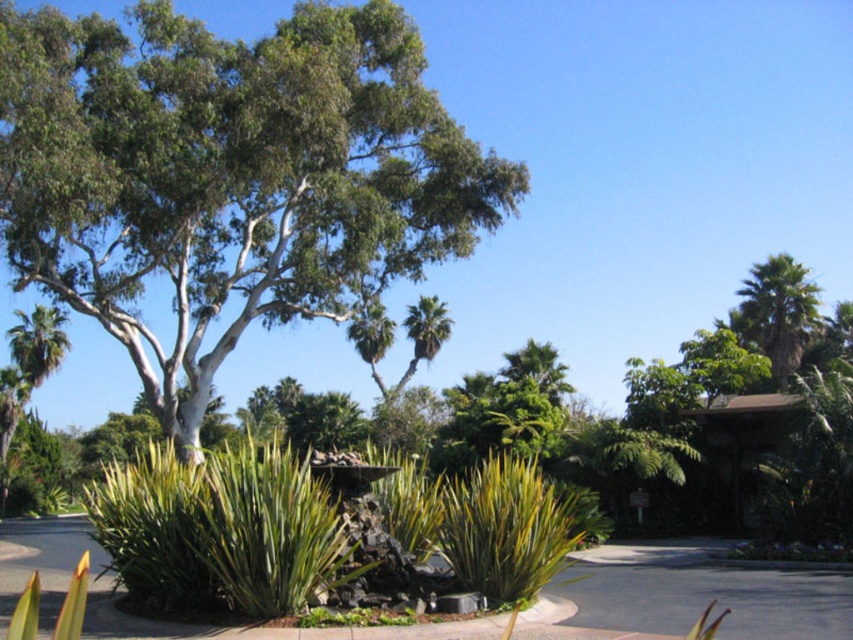
You are a gardener planning to plant a new flower bed between the green leafy tree at center and the green leafy palm at upper right. Based on their positions, which direction should you start digging relative to the tree?

Since the green leafy tree at center is to the left of the green leafy palm at upper right, you should start digging to the right of the green leafy tree at center to place the flower bed between them.